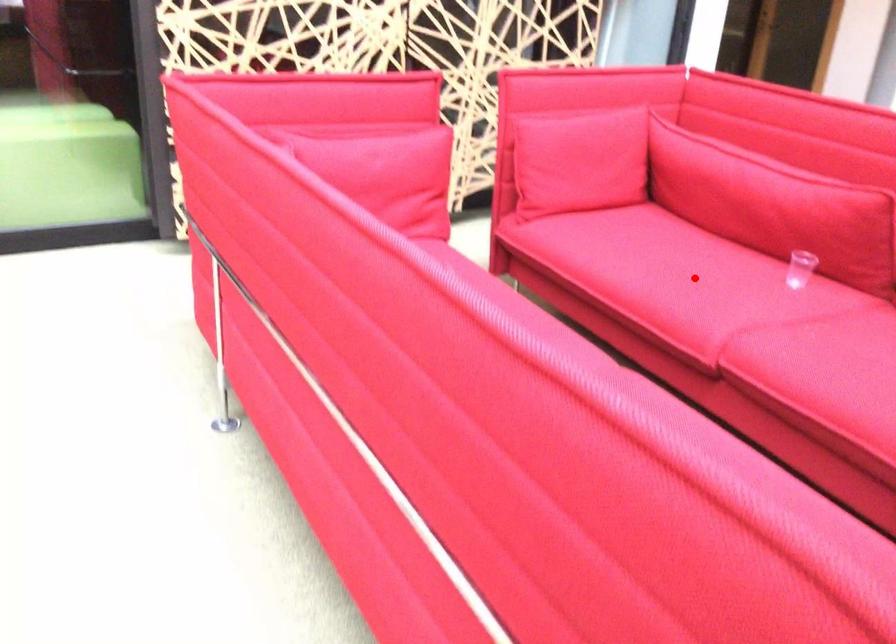
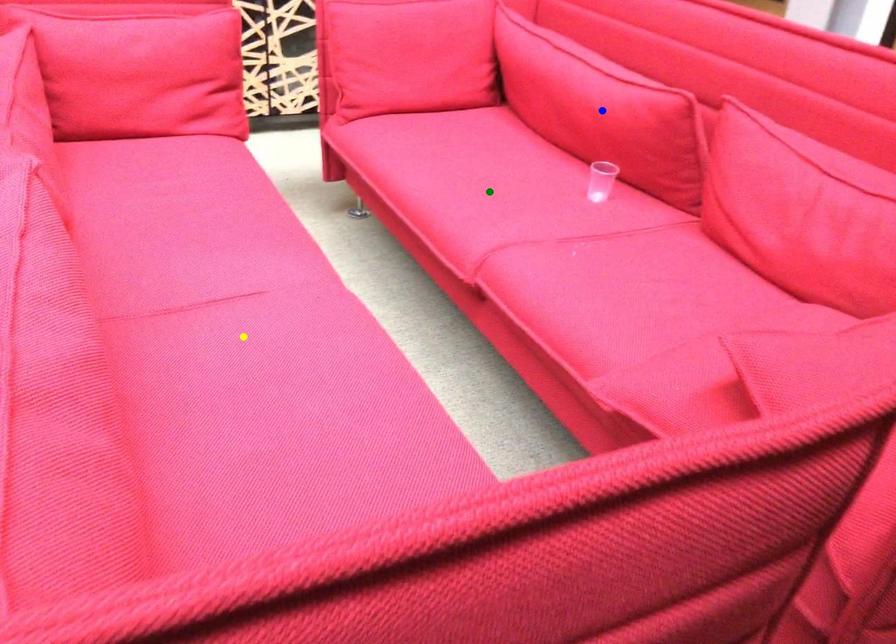
Question: I am providing you with two images of the same scene from different viewpoints. A red point is marked on the first image. You are given multiple points on the second image. In image 2, which mark is for the same physical point as the one in image 1?

Choices:
 (A) blue point
 (B) yellow point
 (C) green point

Answer: (C)